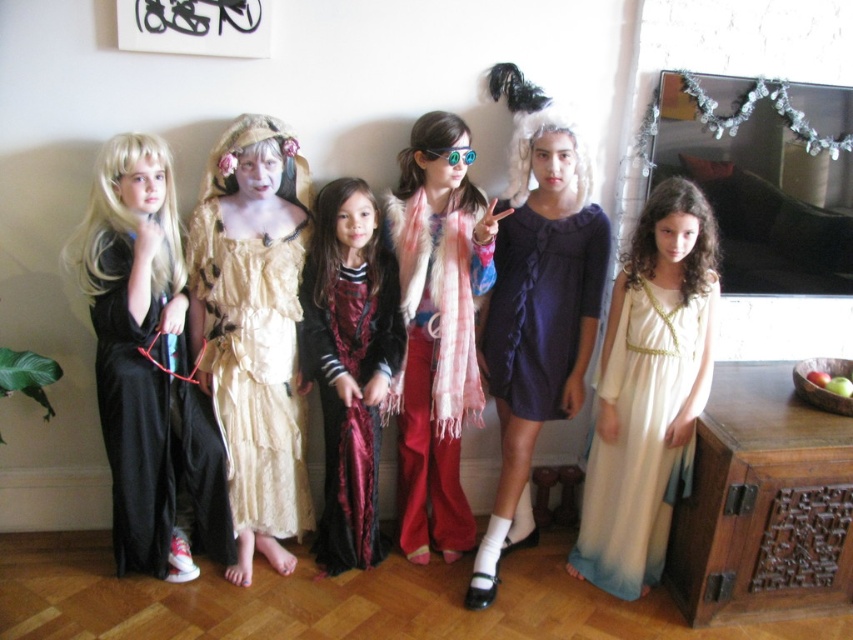
You are organizing a costume party and need to ensure that all dresses are displayed properly. Which of the two dresses at the center, the matte purple dress at center or the dark purple knit dress at center, requires more space due to its size?

The matte purple dress at center requires more space because it is larger in size than the dark purple knit dress at center.

You are standing in the living room and want to find the matte purple dress at center. According to the coordinates given, where would you look to find it?

The matte purple dress at center is located at the 2D coordinates point (537,314).